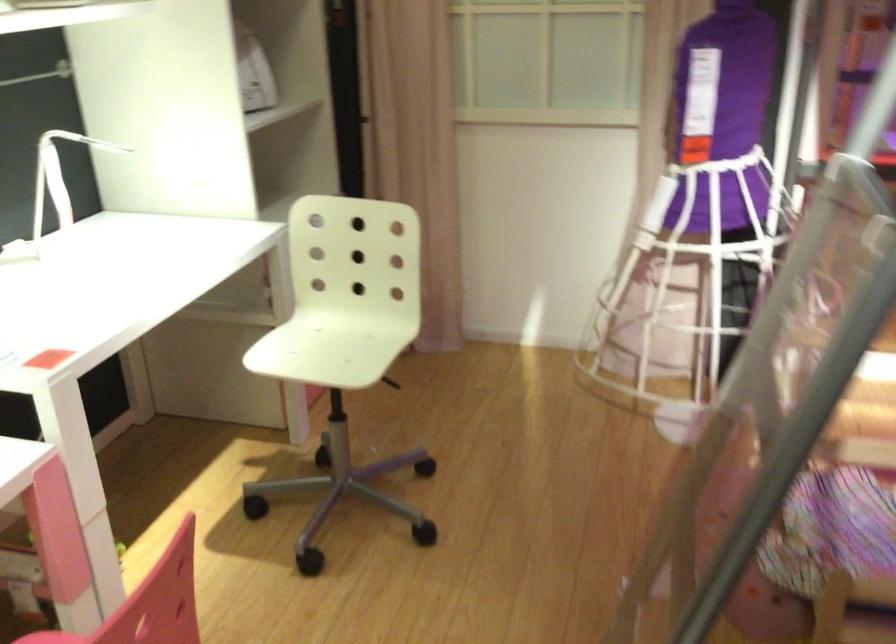
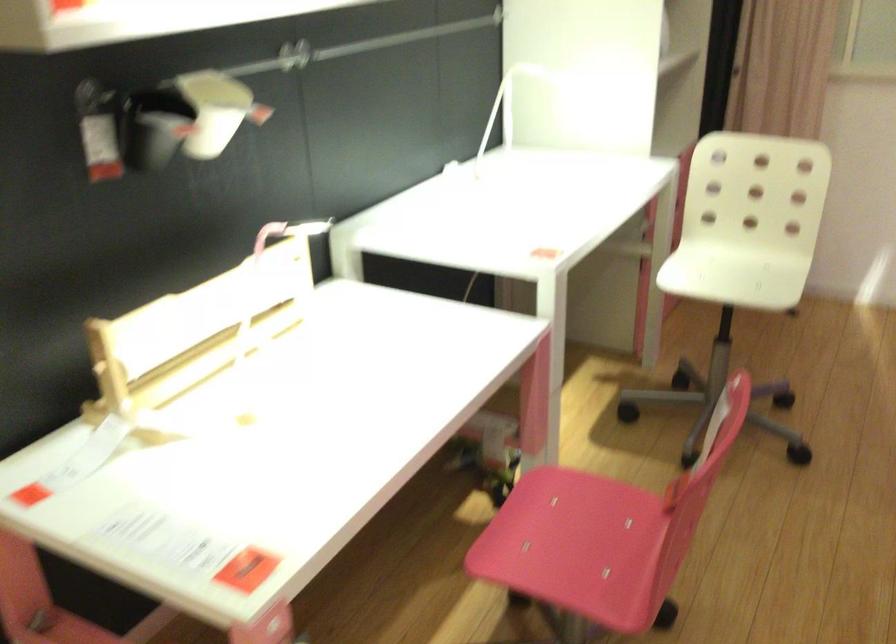
The images are taken continuously from a first-person perspective. In which direction are you moving?

The movement direction of the cameraman is left, backward.